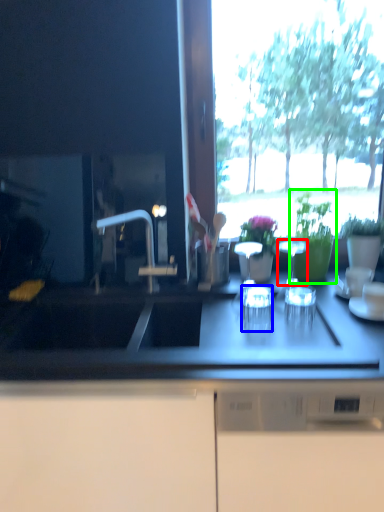
Question: Which object is positioned closest to tableware (highlighted by a red box)? Select from tableware (highlighted by a blue box) and houseplant (highlighted by a green box).

Choices:
 (A) tableware
 (B) houseplant

Answer: (B)